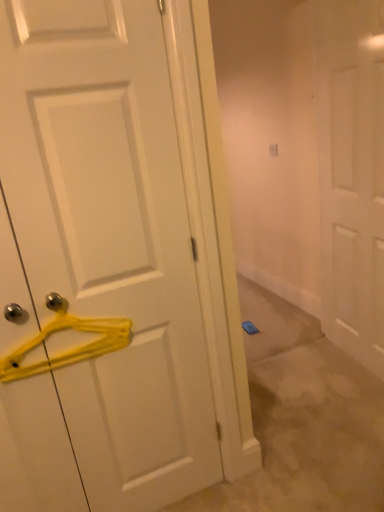
Question: Is white matte door at center, which is the second door in left-to-right order, outside of white matte door at left, which is counted as the first door, starting from the left?

Choices:
 (A) no
 (B) yes

Answer: (B)

Question: Would you say white matte door at left, which appears as the 2th door when viewed from the back, is part of white matte door at center, which is the second door in left-to-right order,'s contents?

Choices:
 (A) yes
 (B) no

Answer: (B)

Question: Can you confirm if white matte door at center, the first door positioned from the back, is bigger than white matte door at left, which appears as the 2th door when viewed from the back?

Choices:
 (A) no
 (B) yes

Answer: (B)

Question: Is white matte door at center, the 2th door viewed from the front, oriented away from white matte door at left, which appears as the 2th door when viewed from the back?

Choices:
 (A) yes
 (B) no

Answer: (B)

Question: From a real-world perspective, is white matte door at center, which is the second door in left-to-right order, on top of white matte door at left, which appears as the 2th door when viewed from the back?

Choices:
 (A) yes
 (B) no

Answer: (A)

Question: Considering their positions, is yellow plastic hanger at left located in front of or behind white matte door at left, acting as the 1th door starting from the front?

Choices:
 (A) front
 (B) behind

Answer: (B)

Question: From the image's perspective, is yellow plastic hanger at left above or below white matte door at left, which is counted as the first door, starting from the left?

Choices:
 (A) above
 (B) below

Answer: (B)

Question: In terms of width, does yellow plastic hanger at left look wider or thinner when compared to white matte door at left, acting as the 1th door starting from the front?

Choices:
 (A) thin
 (B) wide

Answer: (A)

Question: Is yellow plastic hanger at left bigger or smaller than white matte door at left, which appears as the 2th door when viewed from the back?

Choices:
 (A) big
 (B) small

Answer: (B)

Question: Is white matte door at center, the first door positioned from the back, spatially inside yellow plastic hanger at left, or outside of it?

Choices:
 (A) inside
 (B) outside

Answer: (B)

Question: Looking at the image, does white matte door at center, which is the second door in left-to-right order, seem bigger or smaller compared to yellow plastic hanger at left?

Choices:
 (A) big
 (B) small

Answer: (A)

Question: From the image's perspective, is white matte door at center, the 1th door from the right, above or below yellow plastic hanger at left?

Choices:
 (A) above
 (B) below

Answer: (A)

Question: Is white matte door at center, the 2th door viewed from the front, in front of or behind yellow plastic hanger at left in the image?

Choices:
 (A) behind
 (B) front

Answer: (A)

Question: Is white matte door at center, the first door positioned from the back, inside or outside of white matte door at left, which is counted as the first door, starting from the left?

Choices:
 (A) outside
 (B) inside

Answer: (A)

Question: From a real-world perspective, is white matte door at center, the first door positioned from the back, positioned above or below white matte door at left, which appears as the 2th door when viewed from the back?

Choices:
 (A) above
 (B) below

Answer: (A)